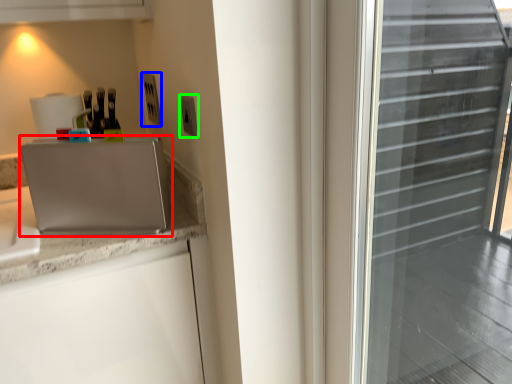
Question: Which object is the farthest from appliance (highlighted by a red box)? Choose among these: electric outlet (highlighted by a blue box) or electric outlet (highlighted by a green box).

Choices:
 (A) electric outlet
 (B) electric outlet

Answer: (A)